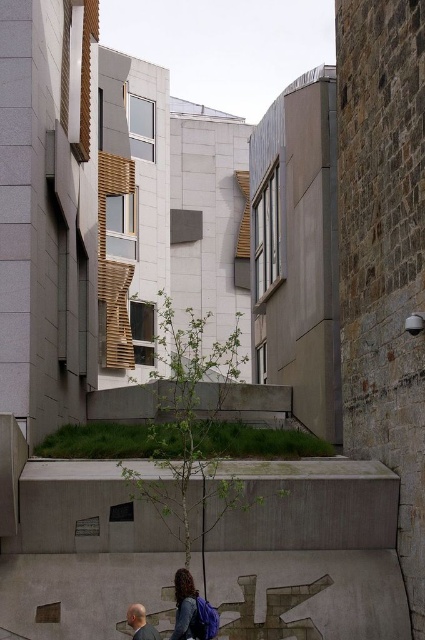
Question: Can you confirm if green leafy tree at center is thinner than matte blue backpack at lower center?

Choices:
 (A) no
 (B) yes

Answer: (A)

Question: Where is green leafy tree at center located in relation to gray hair man at lower left in the image?

Choices:
 (A) below
 (B) above

Answer: (B)

Question: Among these objects, which one is farthest from the camera?

Choices:
 (A) matte blue backpack at lower center
 (B) green leafy tree at center

Answer: (B)

Question: Which of the following is the closest to the observer?

Choices:
 (A) gray hair man at lower left
 (B) matte blue backpack at lower center
 (C) green leafy tree at center

Answer: (A)

Question: Estimate the real-world distances between objects in this image. Which object is closer to the green leafy tree at center?

Choices:
 (A) gray hair man at lower left
 (B) matte blue backpack at lower center

Answer: (B)

Question: Can you confirm if green leafy tree at center is positioned above matte blue backpack at lower center?

Choices:
 (A) no
 (B) yes

Answer: (B)